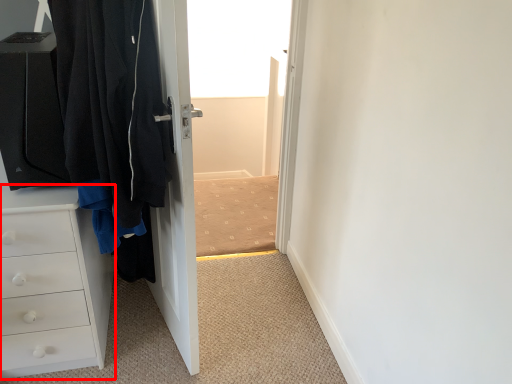
Question: Where is chest of drawers (annotated by the red box) located in relation to door in the image?

Choices:
 (A) right
 (B) left

Answer: (B)